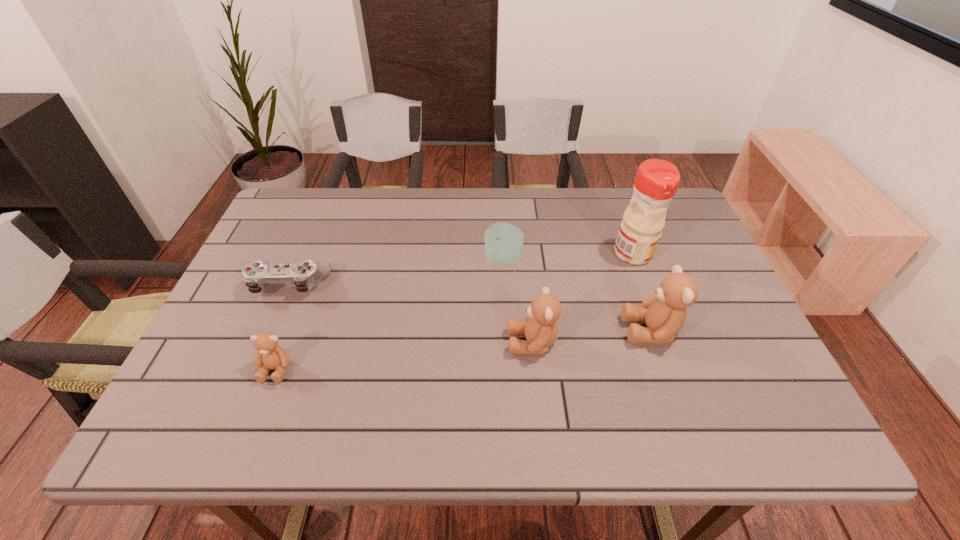
To achieve even spacing by inserting another teddy_bear among them, please point to a vacant spot for this new teddy_bear. Please provide its 2D coordinates. Your answer should be formatted as a tuple, i.e. [(x, y)], where the tuple contains the x and y coordinates of a point satisfying the conditions above.

[(407, 355)]